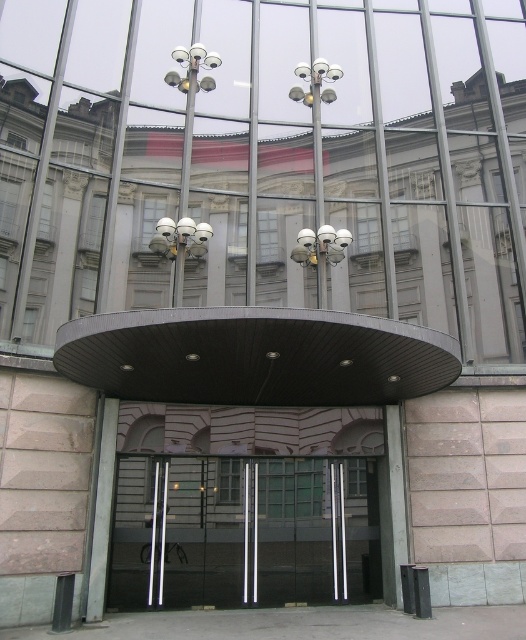
Consider the image. You are standing at the entrance of the building and notice two devices. Which one is positioned to the left of the other? The sleek metallic security cameras at center and the matte silver lamp at upper center.

The sleek metallic security cameras at center are positioned to the left of the matte silver lamp at upper center.

You are standing at the entrance of the building and want to locate the transparent glass door at center. According to the scene, which direction should you look relative to the matte silver lamp at upper center?

You should look to the right of the matte silver lamp at upper center to find the transparent glass door at center, as it is positioned to the right of the lamp.